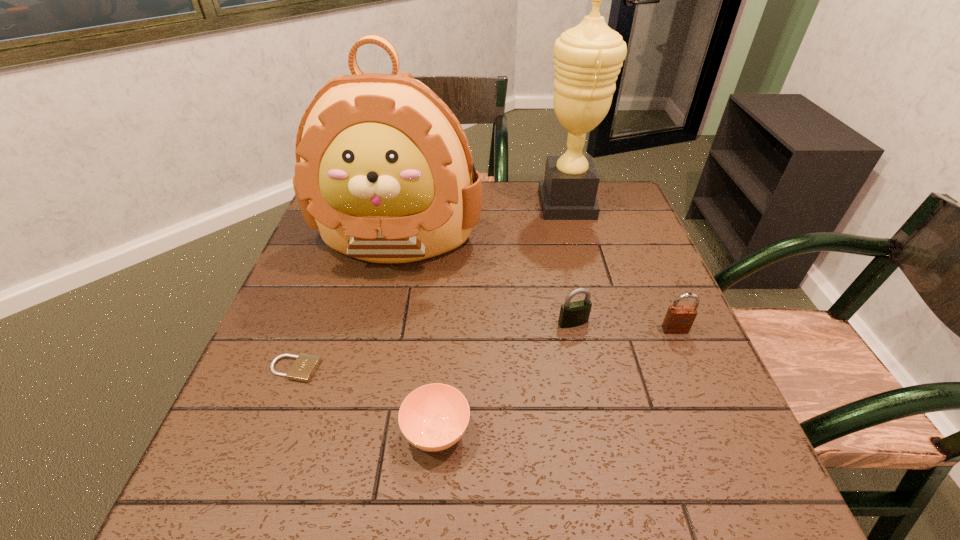
You are a GUI agent. You are given a task and a screenshot of the screen. Output one action in this format:
    pyautogui.click(x=<x>, y=<y>)
    Task: Click on the trophy cup
    This screenshot has width=960, height=540.
    Given the screenshot: What is the action you would take?
    pyautogui.click(x=588, y=57)

At what (x,y) coordinates should I click in order to perform the action: click on backpack. Please return your answer as a coordinate pair (x, y). Looking at the image, I should click on (384, 170).

Identify the location of the rightmost padlock. The image size is (960, 540). (679, 319).

Identify the location of the second padlock from right to left. (572, 314).

Find the location of `the fifth tallest object`. the fifth tallest object is located at coordinates (434, 417).

Locate an element on the screen. soup bowl is located at coordinates (434, 417).

Where is `the shortest padlock`? This screenshot has width=960, height=540. the shortest padlock is located at coordinates (304, 367).

This screenshot has height=540, width=960. I want to click on the nearest padlock, so tap(304, 367).

The width and height of the screenshot is (960, 540). I want to click on vacant space situated 0.100m at the front of the trophy cup with handles, so click(505, 204).

The image size is (960, 540). Identify the location of free location located at the front of the trophy cup with handles. click(x=508, y=204).